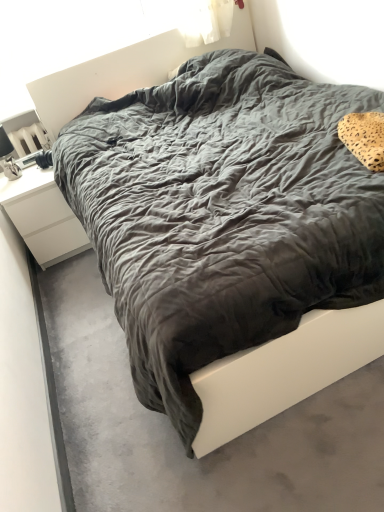
Question: Can you confirm if white matte nightstand at left is bigger than dark gray fabric bed at center?

Choices:
 (A) no
 (B) yes

Answer: (B)

Question: From a real-world perspective, is white matte nightstand at left physically below dark gray fabric bed at center?

Choices:
 (A) no
 (B) yes

Answer: (A)

Question: From a real-world perspective, is white matte nightstand at left over dark gray fabric bed at center?

Choices:
 (A) no
 (B) yes

Answer: (B)

Question: Is white matte nightstand at left looking in the opposite direction of dark gray fabric bed at center?

Choices:
 (A) no
 (B) yes

Answer: (A)

Question: Can you confirm if white matte nightstand at left is taller than dark gray fabric bed at center?

Choices:
 (A) no
 (B) yes

Answer: (B)

Question: Is white matte nightstand at left smaller than dark gray fabric bed at center?

Choices:
 (A) no
 (B) yes

Answer: (A)

Question: Is leopard print fabric pillow at upper right facing towards white matte nightstand at left?

Choices:
 (A) yes
 (B) no

Answer: (B)

Question: Can you confirm if leopard print fabric pillow at upper right is positioned to the left of white matte nightstand at left?

Choices:
 (A) no
 (B) yes

Answer: (A)

Question: Does leopard print fabric pillow at upper right lie in front of white matte nightstand at left?

Choices:
 (A) yes
 (B) no

Answer: (A)

Question: Can white matte nightstand at left be found inside leopard print fabric pillow at upper right?

Choices:
 (A) no
 (B) yes

Answer: (A)

Question: Does leopard print fabric pillow at upper right have a smaller size compared to white matte nightstand at left?

Choices:
 (A) yes
 (B) no

Answer: (A)

Question: Does leopard print fabric pillow at upper right have a lesser width compared to white matte nightstand at left?

Choices:
 (A) yes
 (B) no

Answer: (A)

Question: Is dark gray fabric bed at center completely or partially outside of white matte nightstand at left?

Choices:
 (A) yes
 (B) no

Answer: (A)